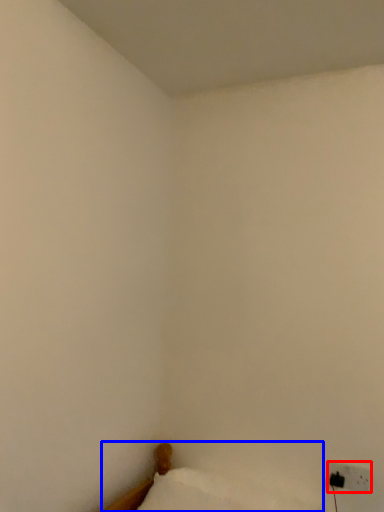
Question: Which point is further to the camera, electric outlet (highlighted by a red box) or furniture (highlighted by a blue box)?

Choices:
 (A) electric outlet
 (B) furniture

Answer: (A)